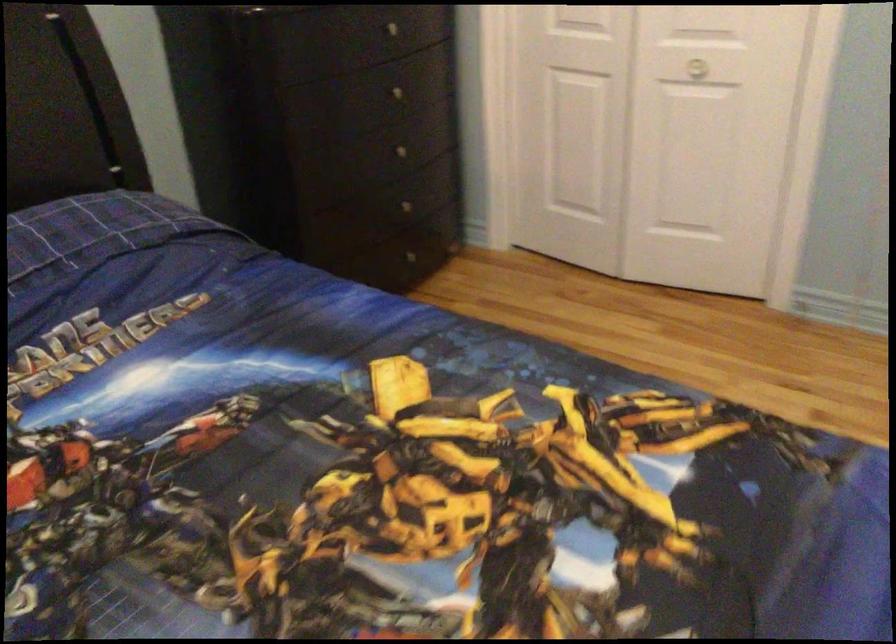
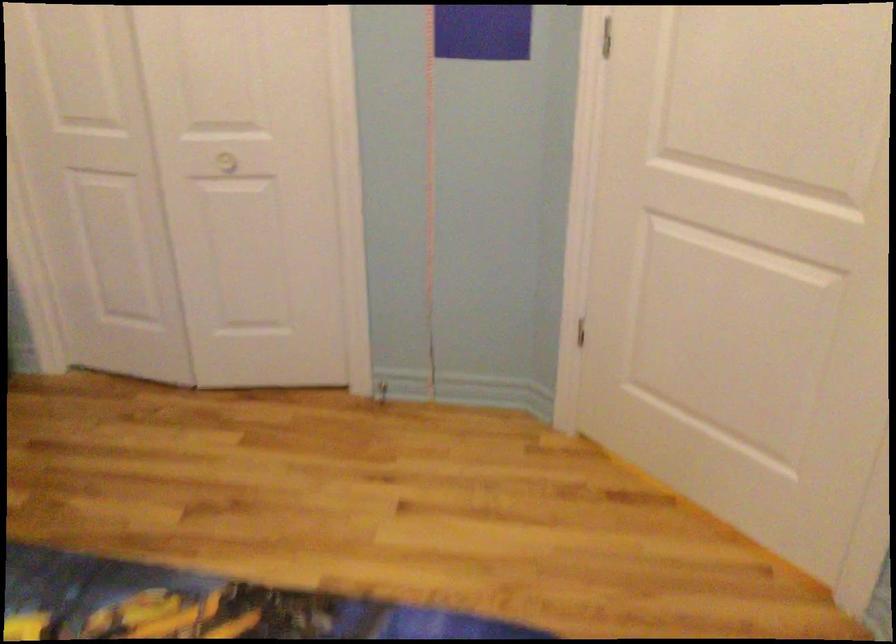
In the second image, find the point that corresponds to point (702, 67) in the first image.

(227, 162)